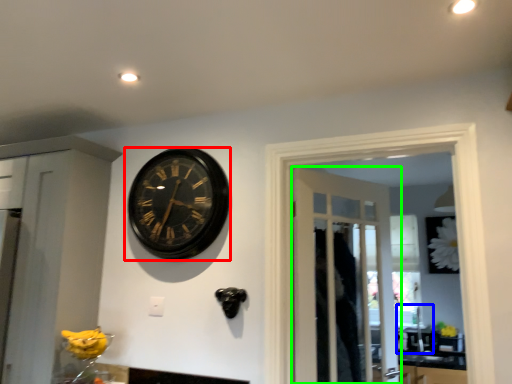
Question: Which is farther away from wall clock (highlighted by a red box)? sink (highlighted by a blue box) or door (highlighted by a green box)?

Choices:
 (A) sink
 (B) door

Answer: (A)